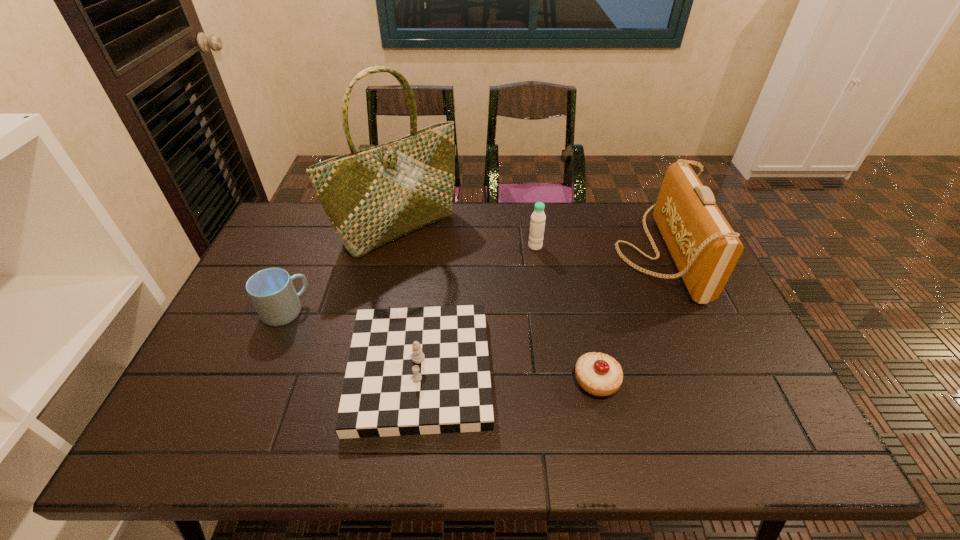
Locate an element on the screen. shopping bag is located at coordinates (373, 196).

Identify the location of handbag. pos(705,248).

This screenshot has height=540, width=960. In order to click on the fifth shortest object in this screenshot , I will do `click(705, 248)`.

Find the location of a particular element. the fourth shortest object is located at coordinates (537, 225).

I want to click on the third object from right to left, so [x=537, y=225].

Identify the location of the leftmost object. (271, 290).

You are a GUI agent. You are given a task and a screenshot of the screen. Output one action in this format:
    pyautogui.click(x=<x>, y=<y>)
    Task: Click on the checkerboard
    Image resolution: width=960 pixels, height=540 pixels.
    Given the screenshot: What is the action you would take?
    pyautogui.click(x=425, y=370)

Identify the location of pastry. Image resolution: width=960 pixels, height=540 pixels. (599, 374).

This screenshot has width=960, height=540. What are the coordinates of `the second object from right to left` in the screenshot? It's located at (599, 374).

This screenshot has width=960, height=540. Find the location of `free space located on the front of the tallest object`. free space located on the front of the tallest object is located at coordinates click(x=385, y=294).